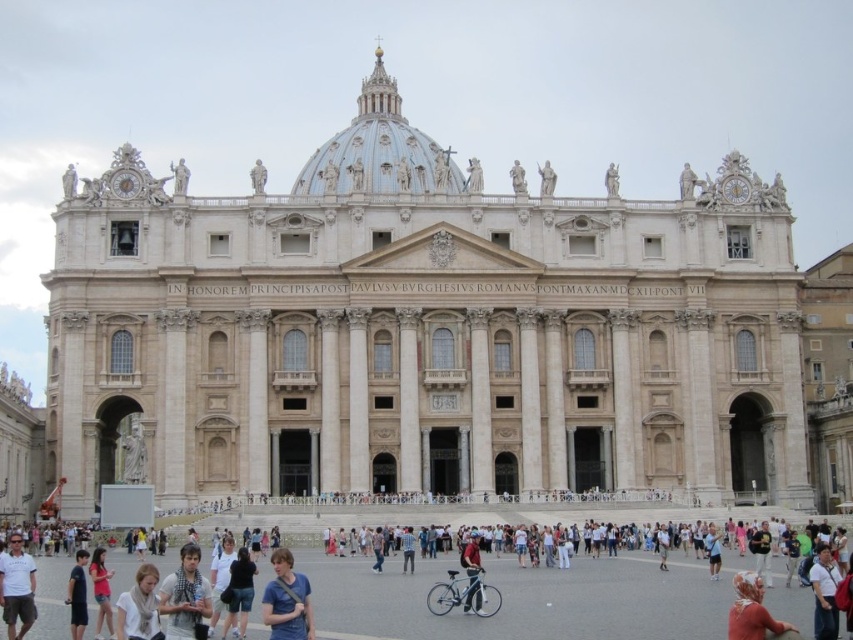
Question: Is the position of blue cotton shirt at lower center less distant than that of dark blue shirt at lower left?

Choices:
 (A) no
 (B) yes

Answer: (B)

Question: Which of these objects is positioned closest to the white cotton shirt at lower left?

Choices:
 (A) denim shorts at lower center
 (B) blue cotton shirt at lower center

Answer: (B)

Question: Estimate the real-world distances between objects in this image. Which object is closer to the white cotton shirt at lower right?

Choices:
 (A) matte pink shirt at lower left
 (B) dark blue shirt at lower left
 (C) beige stone church at center

Answer: (A)

Question: Among these points, which one is farthest from the camera?

Choices:
 (A) (125, 593)
 (B) (363, 113)
 (C) (74, 608)
 (D) (91, 580)

Answer: (B)

Question: Does white cotton shirt at lower left have a greater width compared to white cotton shirt at lower right?

Choices:
 (A) yes
 (B) no

Answer: (A)

Question: In this image, where is white cotton shirt at lower left located relative to light beige scarf at lower left?

Choices:
 (A) left
 (B) right

Answer: (A)